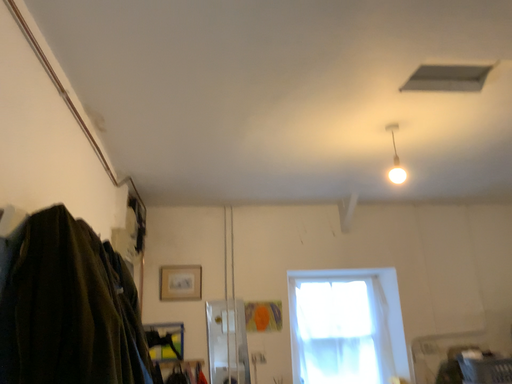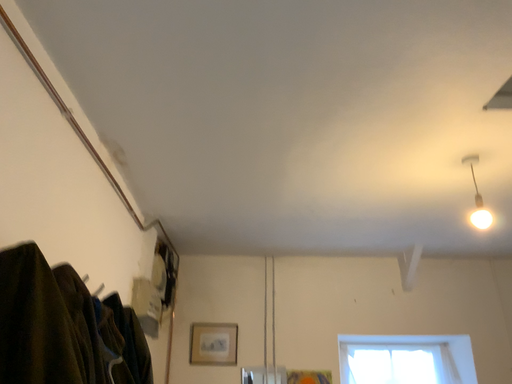
Question: Which way did the camera rotate in the video?

Choices:
 (A) rotated left
 (B) rotated right

Answer: (A)